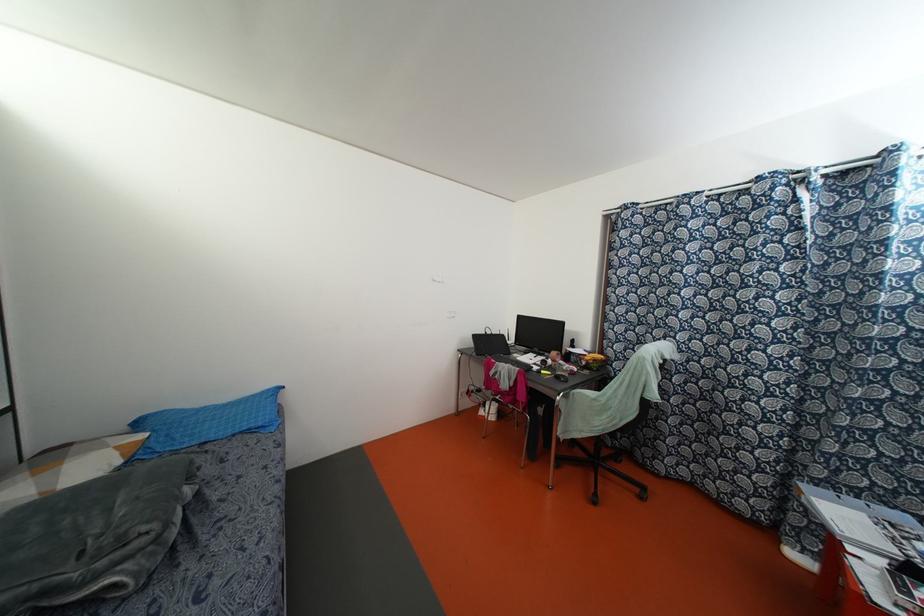
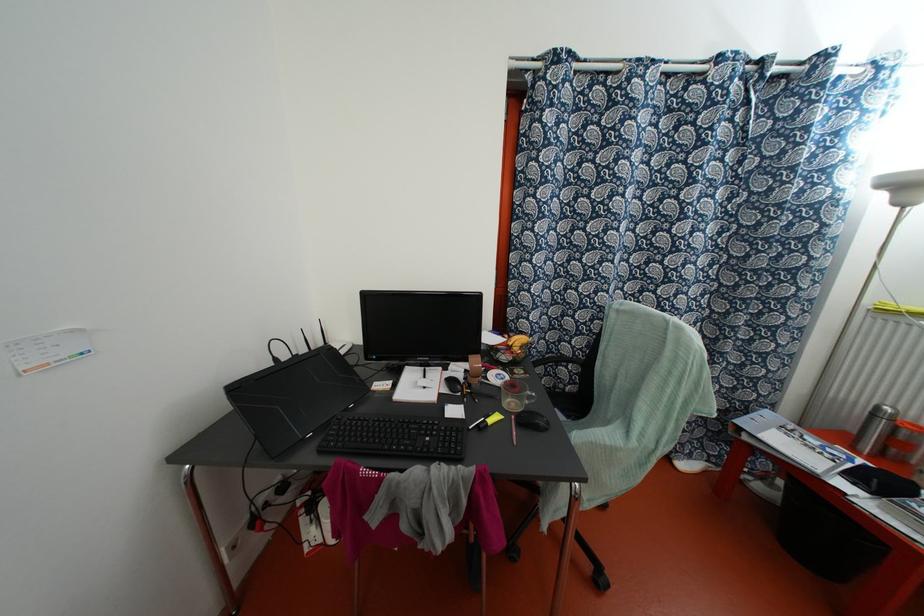
The point at (582, 363) is marked in the first image. Where is the corresponding point in the second image?

(504, 357)